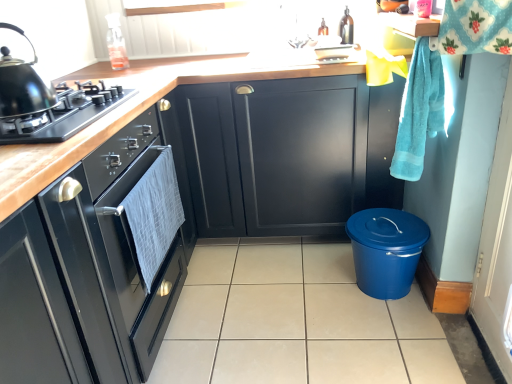
What is the approximate height of turquoise terry cloth hand towel at right?

It is 20.64 inches.

This screenshot has height=384, width=512. I want to click on turquoise terry cloth hand towel at right, so click(419, 111).

Describe the element at coordinates (211, 195) in the screenshot. I see `matte black cabinets at center, the first cabinetry from the front` at that location.

This screenshot has height=384, width=512. I want to click on matte black cabinets at center, the first cabinetry from the front, so click(211, 195).

Measure the distance between matte brown bottle at upper center and camera.

matte brown bottle at upper center and camera are 2.29 meters apart.

What do you see at coordinates (346, 28) in the screenshot?
I see `matte brown bottle at upper center` at bounding box center [346, 28].

In order to face black matte gas stove at left, should I rotate leftwards or rightwards?

Turn left approximately 26.755 degrees to face it.

This screenshot has height=384, width=512. What do you see at coordinates (83, 279) in the screenshot?
I see `matte black oven at left, the 2th cabinetry viewed from the back` at bounding box center [83, 279].

Where is `shiny black kettle at left`? This screenshot has height=384, width=512. shiny black kettle at left is located at coordinates (22, 84).

Locate an element on the screen. The width and height of the screenshot is (512, 384). turquoise terry cloth hand towel at right is located at coordinates (419, 111).

Is point (277, 153) closer to viewer compared to point (396, 303)?

No, it is behind (396, 303).

Between matte black cabinet at center, arranged as the 1th cabinetry when viewed from the back, and beige tile at center, which one has smaller size?

Smaller between the two is beige tile at center.

Consider the image. Considering the positions of objects matte black cabinet at center, arranged as the 1th cabinetry when viewed from the back, and beige tile at center in the image provided, who is in front, matte black cabinet at center, arranged as the 1th cabinetry when viewed from the back, or beige tile at center?

beige tile at center is more forward.

From a real-world perspective, is matte black cabinet at center, which is counted as the 3th cabinetry, starting from the front, located beneath beige tile at center?

No.

Which object is wider, turquoise terry cloth hand towel at right or black matte gas stove at left?

With larger width is black matte gas stove at left.

Where is `gas stove in front of the turquoise terry cloth hand towel at right`? Image resolution: width=512 pixels, height=384 pixels. gas stove in front of the turquoise terry cloth hand towel at right is located at coordinates (64, 116).

Is turquoise terry cloth hand towel at right shorter than black matte gas stove at left?

In fact, turquoise terry cloth hand towel at right may be taller than black matte gas stove at left.

Considering the positions of objects black matte gas stove at left and turquoise terry cloth hand towel at right in the image provided, who is in front, black matte gas stove at left or turquoise terry cloth hand towel at right?

black matte gas stove at left is in front.

Which is further, (x=12, y=141) or (x=405, y=156)?

Point (x=405, y=156)

Measure the distance between black matte gas stove at left and turquoise terry cloth hand towel at right.

They are 1.06 meters apart.

Is shiny black kettle at left at the left side of matte black cabinet at center, arranged as the 1th cabinetry when viewed from the back?

Correct, you'll find shiny black kettle at left to the left of matte black cabinet at center, arranged as the 1th cabinetry when viewed from the back.

Can you tell me how much shiny black kettle at left and matte black cabinet at center, which is counted as the 3th cabinetry, starting from the front, differ in facing direction?

They differ by 83 degrees in their facing directions.

Considering the sizes of objects shiny black kettle at left and matte black cabinet at center, which is counted as the 3th cabinetry, starting from the front, in the image provided, who is shorter, shiny black kettle at left or matte black cabinet at center, which is counted as the 3th cabinetry, starting from the front,?

shiny black kettle at left.

From the image's perspective, is shiny black kettle at left located above matte black cabinet at center, arranged as the 1th cabinetry when viewed from the back?

Yes, from the image's perspective, shiny black kettle at left is above matte black cabinet at center, arranged as the 1th cabinetry when viewed from the back.

This screenshot has height=384, width=512. Find the location of `appliance behind the shiny black kettle at left`. appliance behind the shiny black kettle at left is located at coordinates (346, 28).

Is point (38, 95) in front of point (348, 18)?

Yes.

Is shiny black kettle at left looking in the opposite direction of matte brown bottle at upper center?

No, matte brown bottle at upper center is not at the back of shiny black kettle at left.

Can you confirm if shiny black kettle at left is shorter than matte brown bottle at upper center?

No.

Considering the relative sizes of matte black cabinet at center, arranged as the 1th cabinetry when viewed from the back, and black matte gas stove at left in the image provided, is matte black cabinet at center, arranged as the 1th cabinetry when viewed from the back, thinner than black matte gas stove at left?

No, matte black cabinet at center, arranged as the 1th cabinetry when viewed from the back, is not thinner than black matte gas stove at left.

Which of these two, matte black cabinet at center, arranged as the 1th cabinetry when viewed from the back, or black matte gas stove at left, is bigger?

With larger size is matte black cabinet at center, arranged as the 1th cabinetry when viewed from the back.

What's the angular difference between matte black cabinet at center, arranged as the 1th cabinetry when viewed from the back, and black matte gas stove at left's facing directions?

The angular difference between matte black cabinet at center, arranged as the 1th cabinetry when viewed from the back, and black matte gas stove at left is 88.5 degrees.

The image size is (512, 384). I want to click on the 2nd cabinetry behind the black matte gas stove at left, counting from the anchor's position, so click(269, 155).

Which of these two, matte black oven at left, the 2th cabinetry viewed from the back, or matte brown bottle at upper center, is smaller?

matte brown bottle at upper center is smaller.

Between matte black oven at left, which is the 2th cabinetry in front-to-back order, and matte brown bottle at upper center, which one appears on the left side from the viewer's perspective?

From the viewer's perspective, matte black oven at left, which is the 2th cabinetry in front-to-back order, appears more on the left side.

From a real-world perspective, is matte black oven at left, which is the 2th cabinetry in front-to-back order, physically above matte brown bottle at upper center?

No.

Who is shorter, matte black oven at left, the 2th cabinetry viewed from the back, or matte brown bottle at upper center?

With less height is matte brown bottle at upper center.

This screenshot has width=512, height=384. Find the location of `tile located on the right of matte black cabinet at center, arranged as the 1th cabinetry when viewed from the back`. tile located on the right of matte black cabinet at center, arranged as the 1th cabinetry when viewed from the back is located at coordinates (296, 322).

The image size is (512, 384). Find the location of `gas stove positioned vertically above the turquoise terry cloth hand towel at right (from a real-world perspective)`. gas stove positioned vertically above the turquoise terry cloth hand towel at right (from a real-world perspective) is located at coordinates (64, 116).

When comparing their distances from shiny black kettle at left, does turquoise terry cloth hand towel at right or matte black cabinets at center, the third cabinetry positioned from the back, seem further?

Based on the image, turquoise terry cloth hand towel at right appears to be further to shiny black kettle at left.

Considering their positions, is black matte gas stove at left positioned closer to matte black oven at left, which is the 2th cabinetry in front-to-back order, than beige tile at center?

The object closer to matte black oven at left, which is the 2th cabinetry in front-to-back order, is black matte gas stove at left.

Based on their spatial positions, is matte black cabinets at center, the first cabinetry from the front, or black matte gas stove at left closer to matte black cabinet at center, arranged as the 1th cabinetry when viewed from the back?

The object closer to matte black cabinet at center, arranged as the 1th cabinetry when viewed from the back, is matte black cabinets at center, the first cabinetry from the front.

Estimate the real-world distances between objects in this image. Which object is closer to shiny black kettle at left, matte black cabinets at center, the third cabinetry positioned from the back, or matte black cabinet at center, which is counted as the 3th cabinetry, starting from the front?

matte black cabinets at center, the third cabinetry positioned from the back, is closer to shiny black kettle at left.

From the image, which object appears to be farther from turquoise terry cloth hand towel at right, black matte gas stove at left or matte black oven at left, the 2th cabinetry viewed from the back?

A: black matte gas stove at left is positioned further to the anchor turquoise terry cloth hand towel at right.

Based on their spatial positions, is matte black cabinets at center, the first cabinetry from the front, or shiny black kettle at left closer to turquoise terry cloth hand towel at right?

Among the two, matte black cabinets at center, the first cabinetry from the front, is located nearer to turquoise terry cloth hand towel at right.

Looking at this image, estimate the real-world distances between objects in this image. Which object is closer to turquoise terry cloth hand towel at right, beige tile at center or matte black cabinet at center, which is counted as the 3th cabinetry, starting from the front?

Based on the image, matte black cabinet at center, which is counted as the 3th cabinetry, starting from the front, appears to be nearer to turquoise terry cloth hand towel at right.

Estimate the real-world distances between objects in this image. Which object is further from black matte gas stove at left, shiny black kettle at left or turquoise terry cloth hand towel at right?

turquoise terry cloth hand towel at right is further to black matte gas stove at left.

This screenshot has height=384, width=512. Find the location of `gas stove between matte black cabinets at center, the first cabinetry from the front, and matte brown bottle at upper center in the front-back direction`. gas stove between matte black cabinets at center, the first cabinetry from the front, and matte brown bottle at upper center in the front-back direction is located at coordinates (64, 116).

Where is `tile situated between matte black oven at left, which is the 2th cabinetry in front-to-back order, and turquoise terry cloth hand towel at right from left to right`? tile situated between matte black oven at left, which is the 2th cabinetry in front-to-back order, and turquoise terry cloth hand towel at right from left to right is located at coordinates (296, 322).

The width and height of the screenshot is (512, 384). What are the coordinates of `appliance situated between shiny black kettle at left and turquoise terry cloth hand towel at right from left to right` in the screenshot? It's located at (346, 28).

Where is `gas stove positioned between matte black cabinets at center, the third cabinetry positioned from the back, and matte black cabinet at center, arranged as the 1th cabinetry when viewed from the back, from near to far`? gas stove positioned between matte black cabinets at center, the third cabinetry positioned from the back, and matte black cabinet at center, arranged as the 1th cabinetry when viewed from the back, from near to far is located at coordinates (64, 116).